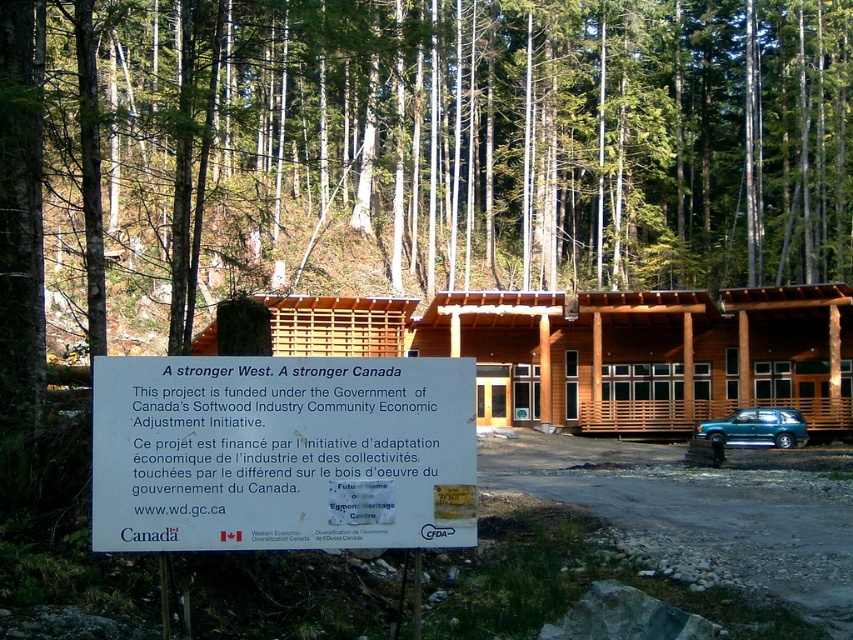
Question: Which object is closer to the camera taking this photo?

Choices:
 (A) teal glossy car at lower right
 (B) white paper sign at center

Answer: (B)

Question: Does white paper sign at center appear on the left side of teal glossy car at lower right?

Choices:
 (A) yes
 (B) no

Answer: (A)

Question: From the image, what is the correct spatial relationship of white paper sign at center in relation to wooden cabin at center?

Choices:
 (A) above
 (B) below

Answer: (B)

Question: Among these points, which one is farthest from the camera?

Choices:
 (A) (x=223, y=419)
 (B) (x=804, y=436)
 (C) (x=425, y=328)

Answer: (C)

Question: Based on their relative distances, which object is nearer to the teal glossy car at lower right?

Choices:
 (A) wooden cabin at center
 (B) white paper sign at center

Answer: (A)

Question: Does white paper sign at center have a lesser width compared to wooden cabin at center?

Choices:
 (A) no
 (B) yes

Answer: (B)